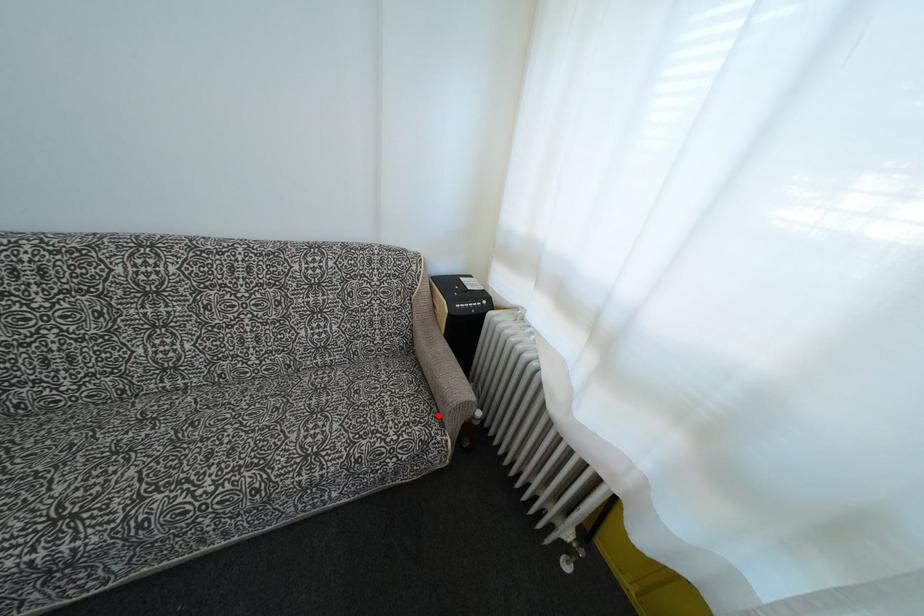
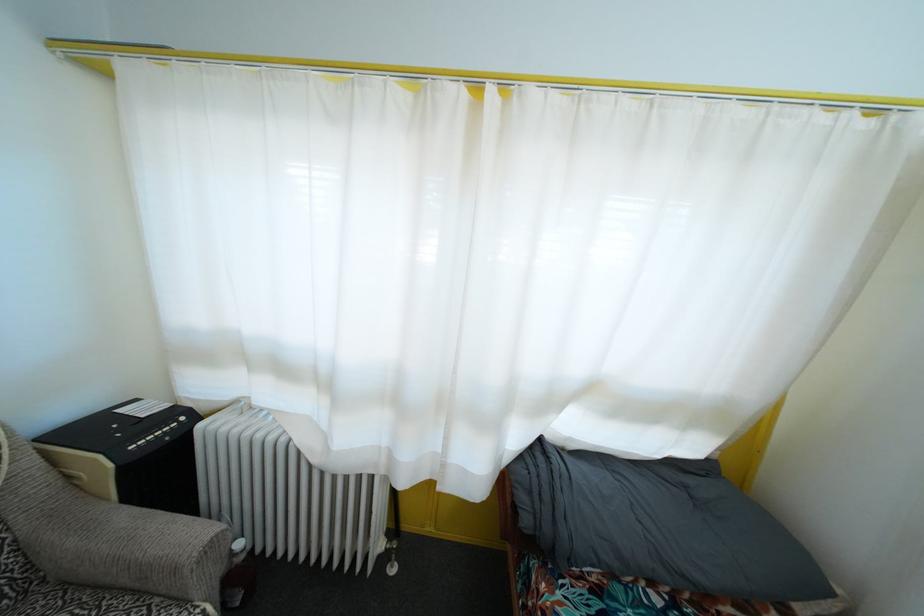
The point at the highlighted location is marked in the first image. Where is the corresponding point in the second image?

(161, 608)